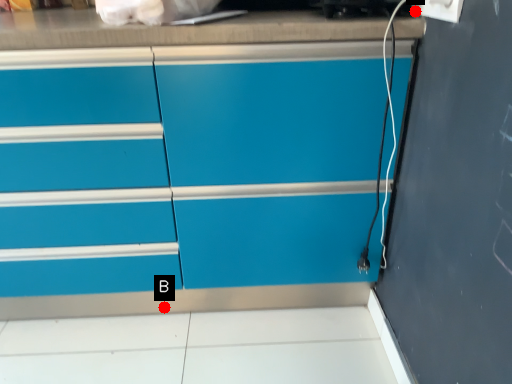
Question: Two points are circled on the image, labeled by A and B beside each circle. Which point is farther from the camera taking this photo?

Choices:
 (A) A is further
 (B) B is further

Answer: (B)